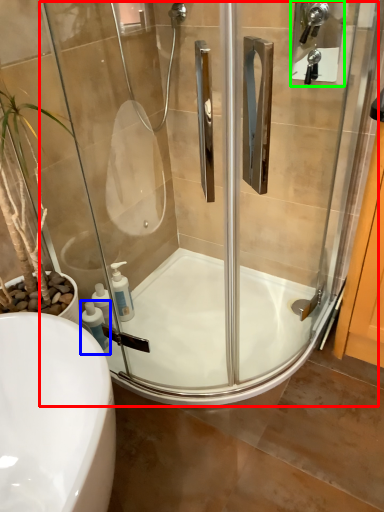
Question: Considering the real-world distances, which object is closest to screen door (highlighted by a red box)? soap dispenser (highlighted by a blue box) or shower (highlighted by a green box).

Choices:
 (A) soap dispenser
 (B) shower

Answer: (A)